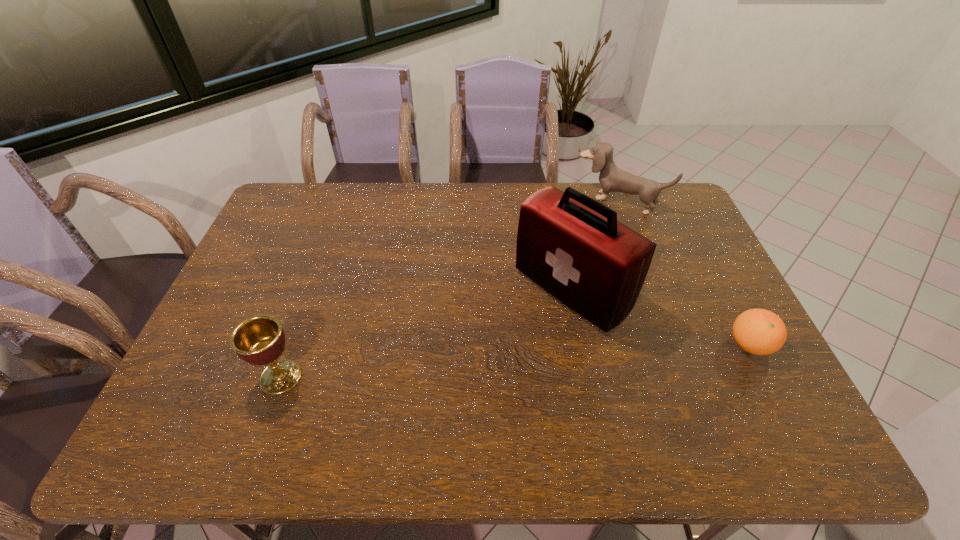
Locate an element on the screen. free spot between the chalice and the shortest object is located at coordinates (516, 361).

Locate an element on the screen. object that is the second closest one to the leftmost object is located at coordinates (612, 179).

Point out which object is positioned as the second nearest to the first aid kit. Please provide its 2D coordinates. Your answer should be formatted as a tuple, i.e. [(x, y)], where the tuple contains the x and y coordinates of a point satisfying the conditions above.

[(758, 331)]

The width and height of the screenshot is (960, 540). In order to click on vacant space that satisfies the following two spatial constraints: 1. on the front side of the first aid kit; 2. on the right side of the orange in this screenshot , I will do `click(582, 345)`.

The height and width of the screenshot is (540, 960). Identify the location of vacant space that satisfies the following two spatial constraints: 1. on the front side of the puppy; 2. on the left side of the shortest object. (670, 345).